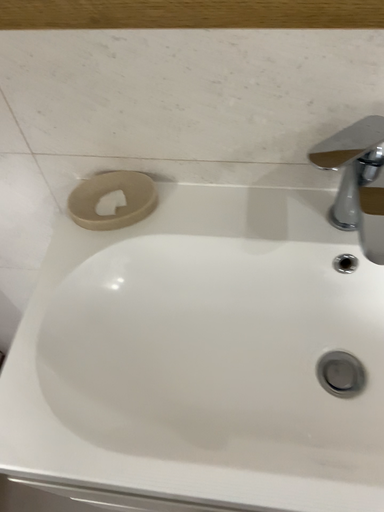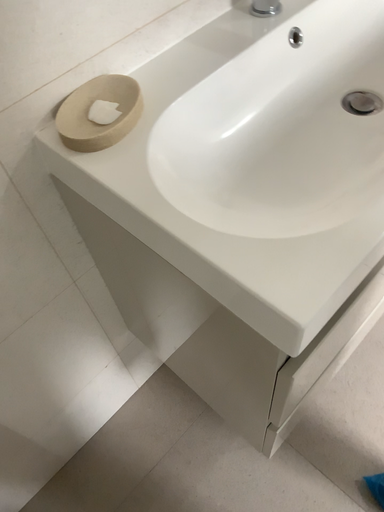
Question: Which way did the camera rotate in the video?

Choices:
 (A) rotated right
 (B) rotated left

Answer: (A)